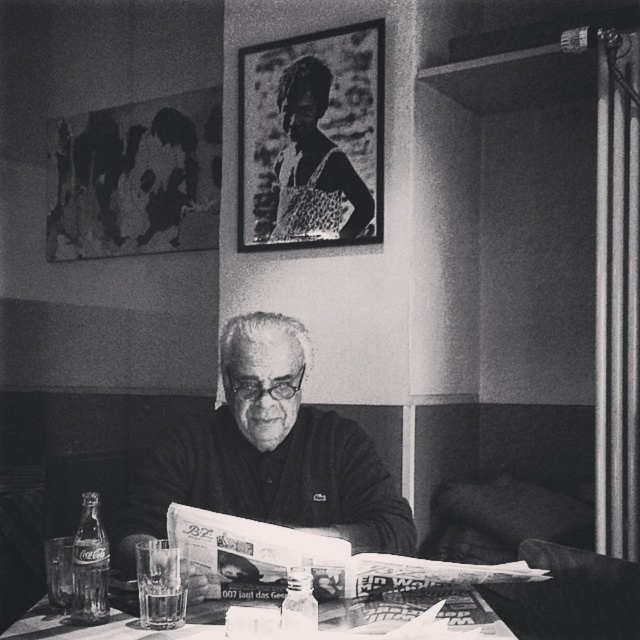
Question: Based on their relative distances, which object is nearer to the metallic frame at upper center?

Choices:
 (A) smooth black sweater at center
 (B) smooth glass table at center

Answer: (A)

Question: Which of these objects is positioned farthest from the smooth black sweater at center?

Choices:
 (A) smooth glass table at center
 (B) metallic frame at upper center

Answer: (B)

Question: Is smooth black sweater at center in front of metallic frame at upper center?

Choices:
 (A) no
 (B) yes

Answer: (B)

Question: Is smooth black sweater at center above smooth glass table at center?

Choices:
 (A) no
 (B) yes

Answer: (B)

Question: Considering the relative positions of smooth black sweater at center and smooth glass table at center in the image provided, where is smooth black sweater at center located with respect to smooth glass table at center?

Choices:
 (A) left
 (B) right

Answer: (B)

Question: Among these objects, which one is farthest from the camera?

Choices:
 (A) smooth black sweater at center
 (B) smooth glass table at center

Answer: (A)